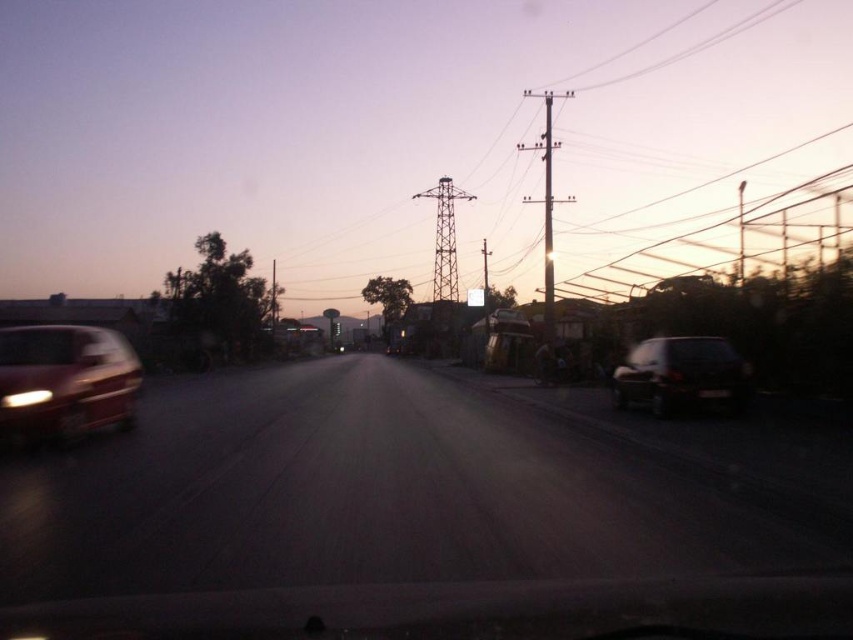
Question: In this image, where is shiny red car at left located relative to dark gray metallic car at right?

Choices:
 (A) above
 (B) below

Answer: (A)

Question: Does shiny red car at left appear on the left side of dark gray metallic car at right?

Choices:
 (A) yes
 (B) no

Answer: (A)

Question: Which point is farther from the camera taking this photo?

Choices:
 (A) pyautogui.click(x=688, y=385)
 (B) pyautogui.click(x=35, y=417)

Answer: (A)

Question: Which point is closer to the camera?

Choices:
 (A) (129, 369)
 (B) (683, 401)

Answer: (A)

Question: Is shiny red car at left below dark gray metallic car at right?

Choices:
 (A) yes
 (B) no

Answer: (B)

Question: Which object is farther from the camera taking this photo?

Choices:
 (A) dark gray metallic car at right
 (B) shiny red car at left

Answer: (A)